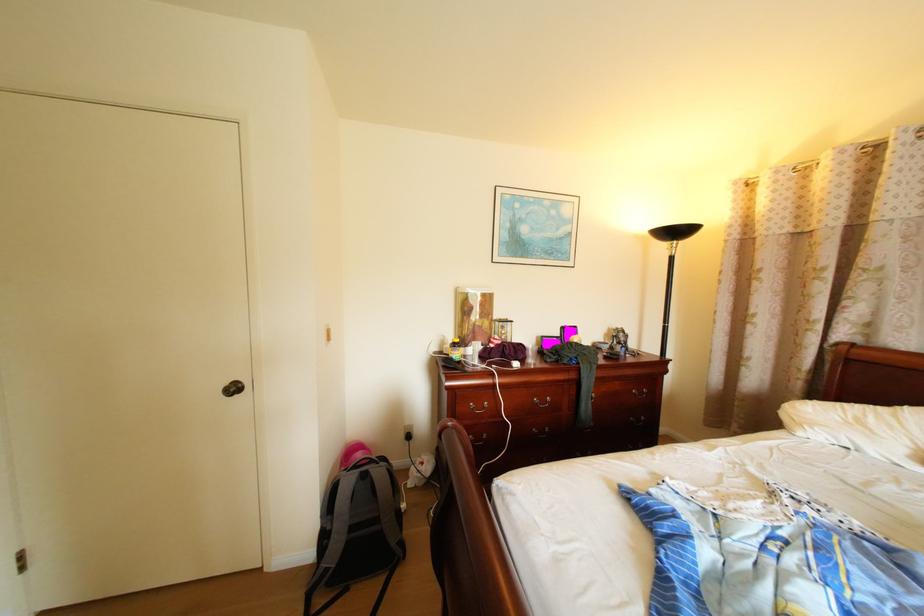
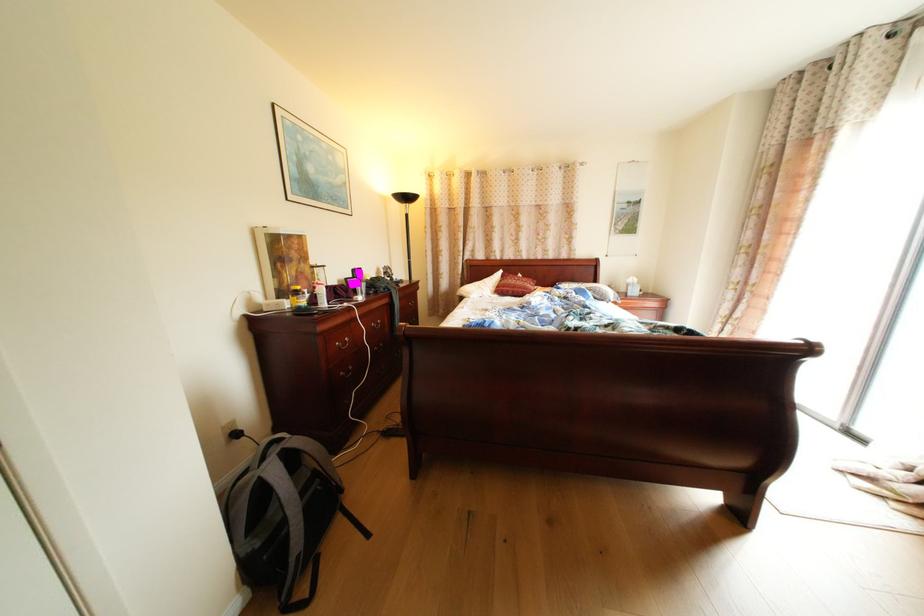
Question: Based on the continuous images, in which direction is the camera rotating? Reply with the corresponding letter.

Choices:
 (A) Left
 (B) Right
 (C) Up
 (D) Down

Answer: (B)